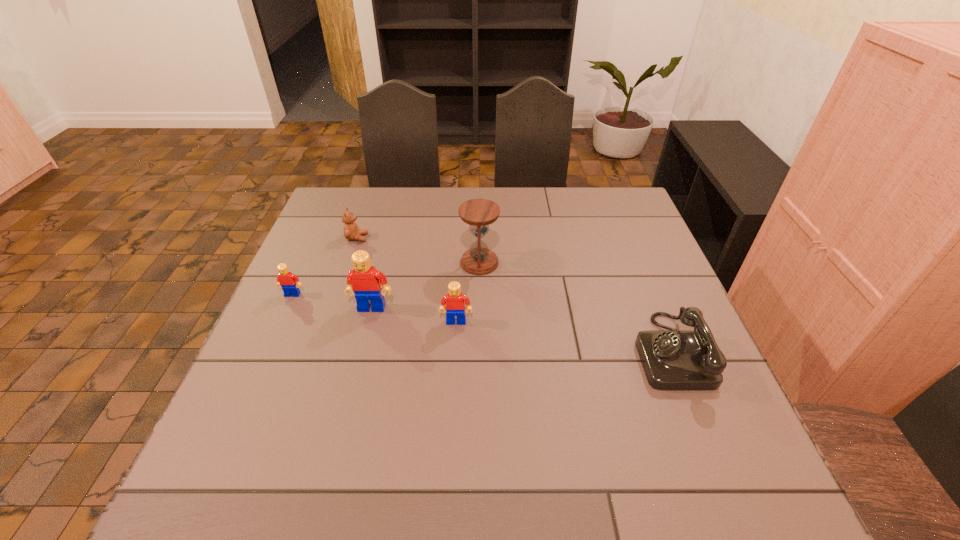
With all Legos evenly spaced, where should an extra Lego be placed on the right to continue the pattern? Please point out a vacant space. Please provide its 2D coordinates. Your answer should be formatted as a tuple, i.e. [(x, y)], where the tuple contains the x and y coordinates of a point satisfying the conditions above.

[(546, 336)]